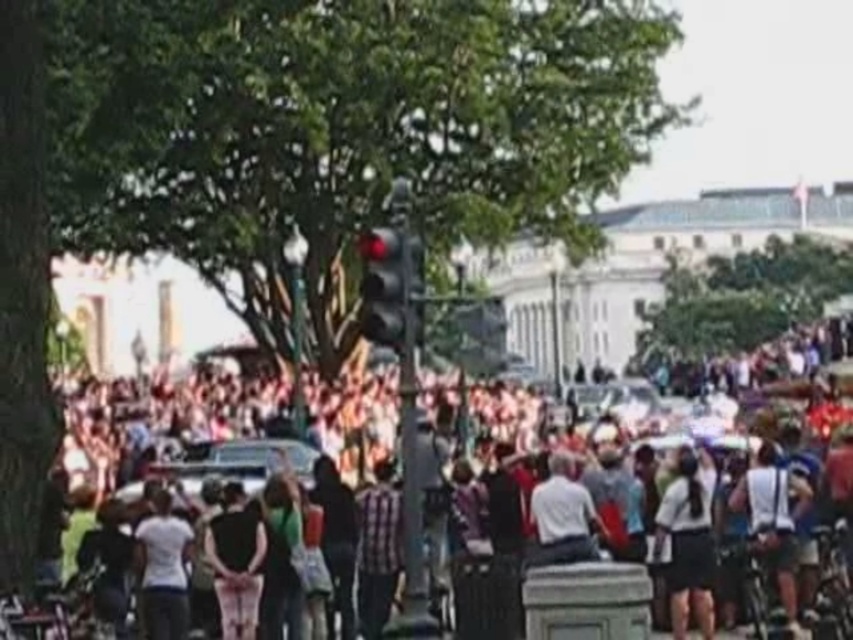
Question: Can you confirm if white cotton shirt at center is positioned above black glass traffic light at center?

Choices:
 (A) no
 (B) yes

Answer: (A)

Question: Which object is closer to the camera taking this photo?

Choices:
 (A) matte black crowd at center
 (B) black glass traffic light at center
 (C) white cotton shirt at center

Answer: (A)

Question: Is matte black crowd at center smaller than black glass traffic light at center?

Choices:
 (A) no
 (B) yes

Answer: (A)

Question: Is matte black crowd at center in front of black glass traffic light at center?

Choices:
 (A) yes
 (B) no

Answer: (A)

Question: Which point is farther from the camera taking this photo?

Choices:
 (A) (183, 483)
 (B) (397, 280)

Answer: (A)

Question: Which object is closer to the camera taking this photo?

Choices:
 (A) black glass traffic light at center
 (B) white cotton shirt at center

Answer: (A)